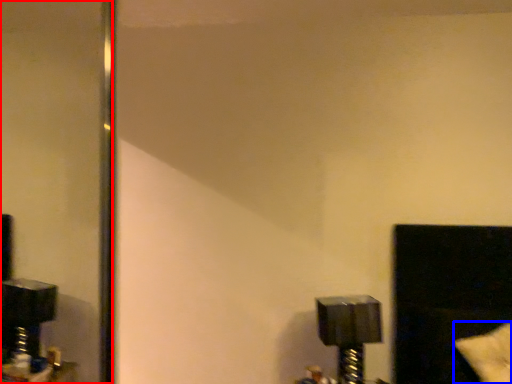
Question: Among these objects, which one is farthest to the camera, mirror (highlighted by a red box) or pillow (highlighted by a blue box)?

Choices:
 (A) mirror
 (B) pillow

Answer: (A)